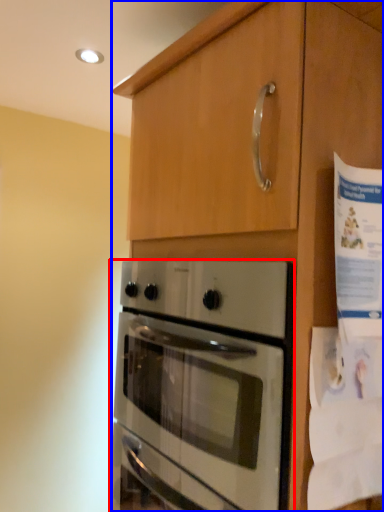
Question: Which of the following is the farthest to the observer, oven (highlighted by a red box) or cabinetry (highlighted by a blue box)?

Choices:
 (A) oven
 (B) cabinetry

Answer: (A)